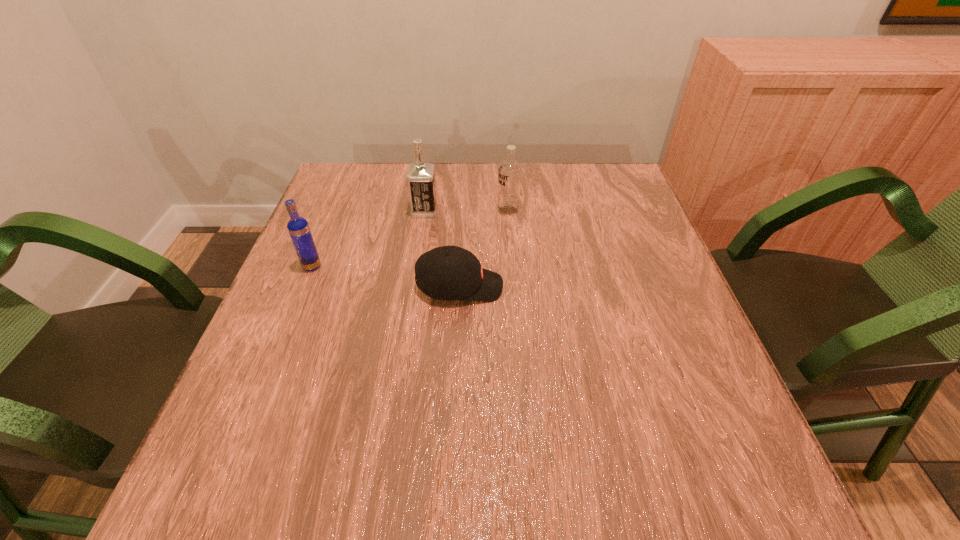
Image resolution: width=960 pixels, height=540 pixels. I want to click on vacant space that's between the nearest vodka and the second vodka from right to left, so click(x=369, y=239).

What are the coordinates of `free space between the nearest vodka and the shortest object` in the screenshot? It's located at (386, 276).

Where is `free space between the leftmost object and the second vodka from right to left`? The image size is (960, 540). free space between the leftmost object and the second vodka from right to left is located at coordinates (369, 239).

You are a GUI agent. You are given a task and a screenshot of the screen. Output one action in this format:
    pyautogui.click(x=<x>, y=<y>)
    Task: Click on the unoccupied position between the nearest vodka and the shortest object
    
    Given the screenshot: What is the action you would take?
    pyautogui.click(x=386, y=276)

Find the location of a particular element. This screenshot has height=540, width=960. blank region between the nearest vodka and the second vodka from left to right is located at coordinates (369, 239).

The image size is (960, 540). Find the location of `empty space between the second vodka from left to right and the nearest vodka`. empty space between the second vodka from left to right and the nearest vodka is located at coordinates (369, 239).

The image size is (960, 540). Identify the location of blank region between the second vodka from right to left and the leftmost object. (369, 239).

What are the coordinates of `free spot between the nearest vodka and the baseball cap` in the screenshot? It's located at (386, 276).

Where is `object that is the closest to the second vodka from left to right`? This screenshot has height=540, width=960. object that is the closest to the second vodka from left to right is located at coordinates (509, 173).

I want to click on object identified as the second closest to the second vodka from right to left, so click(x=450, y=272).